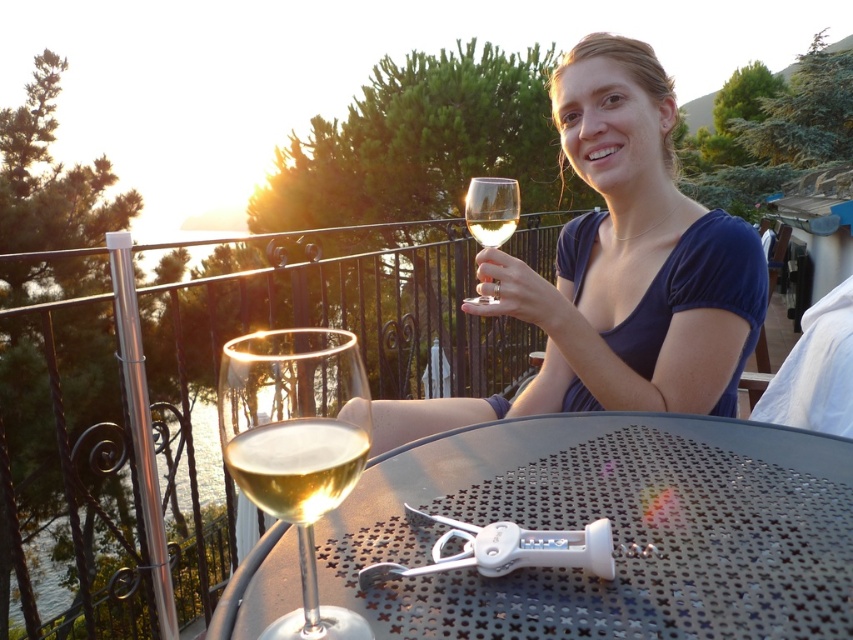
Question: Does clear glass wine glass at center have a larger size compared to clear glass wine glass at upper center?

Choices:
 (A) yes
 (B) no

Answer: (B)

Question: Which object is closer to the camera taking this photo?

Choices:
 (A) clear glass wine glass at center
 (B) matte glass wine glass at center
 (C) clear glass wine at lower left

Answer: (A)

Question: Which point is closer to the camera?

Choices:
 (A) (465, 204)
 (B) (299, 524)
 (C) (259, 429)

Answer: (C)

Question: Is metallic gray table at center in front of clear glass wine at lower left?

Choices:
 (A) no
 (B) yes

Answer: (A)

Question: Is the position of matte glass wine glass at center less distant than that of clear glass wine glass at center?

Choices:
 (A) yes
 (B) no

Answer: (B)

Question: Which point is farther to the camera?

Choices:
 (A) (566, 435)
 (B) (599, 241)
 (C) (517, 204)

Answer: (B)